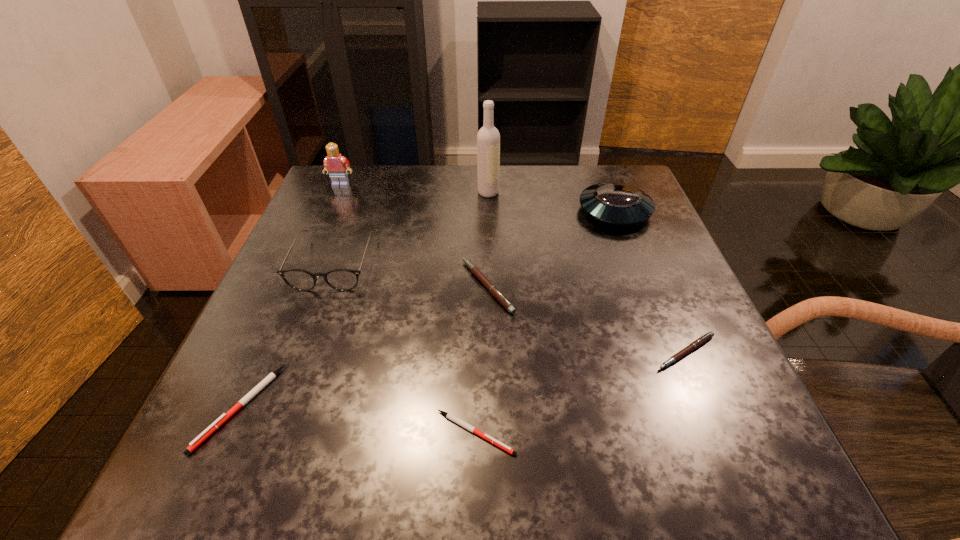
At what (x,y) coordinates should I click in order to perform the action: click on object positioned at the far left corner. Please return your answer as a coordinate pair (x, y). Looking at the image, I should click on (335, 164).

You are a GUI agent. You are given a task and a screenshot of the screen. Output one action in this format:
    pyautogui.click(x=<x>, y=<y>)
    Task: Click on the object that is at the near left corner
    This screenshot has height=540, width=960.
    Given the screenshot: What is the action you would take?
    pyautogui.click(x=224, y=417)

At what (x,y) coordinates should I click in order to perform the action: click on object positioned at the far right corner. Please return your answer as a coordinate pair (x, y). This screenshot has width=960, height=540. Looking at the image, I should click on (617, 203).

Locate an element on the screen. Image resolution: width=960 pixels, height=540 pixels. vacant area at the far edge is located at coordinates (468, 174).

In the image, there is a desktop. At what (x,y) coordinates should I click in order to perform the action: click on free space at the near edge. Please return your answer as a coordinate pair (x, y). Looking at the image, I should click on (635, 484).

The width and height of the screenshot is (960, 540). Identify the location of vacant space at the left edge of the desktop. (315, 234).

In the image, there is a desktop. Identify the location of blank space at the right edge. (682, 429).

In the image, there is a desktop. Where is `vacant space at the far left corner`? This screenshot has height=540, width=960. vacant space at the far left corner is located at coordinates (370, 180).

This screenshot has height=540, width=960. In order to click on vacant region at the far right corner of the desktop in this screenshot , I will do `click(618, 167)`.

The image size is (960, 540). What are the coordinates of `blank region between the gray saucer and the second tallest object` in the screenshot? It's located at (478, 198).